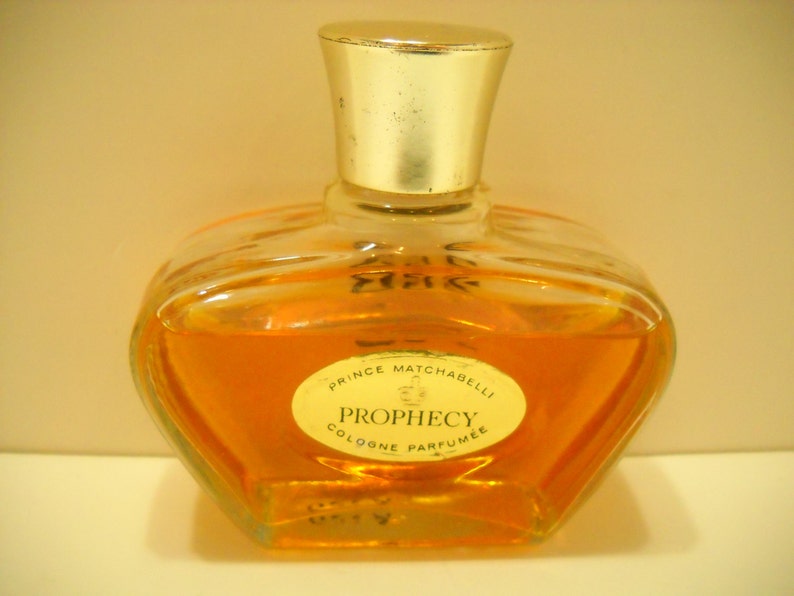
Identify the location of bottle. Image resolution: width=794 pixels, height=596 pixels. [x=522, y=398].